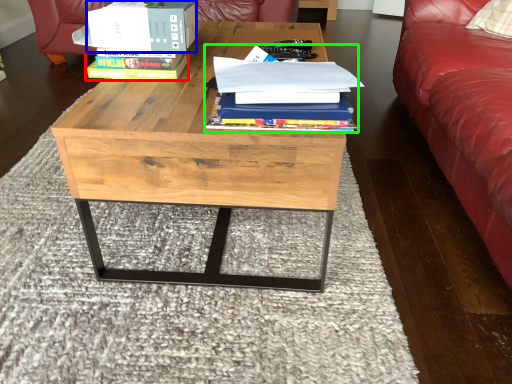
Question: Which is farther away from paperback book (highlighted by a red box)? box (highlighted by a blue box) or book (highlighted by a green box)?

Choices:
 (A) box
 (B) book

Answer: (B)